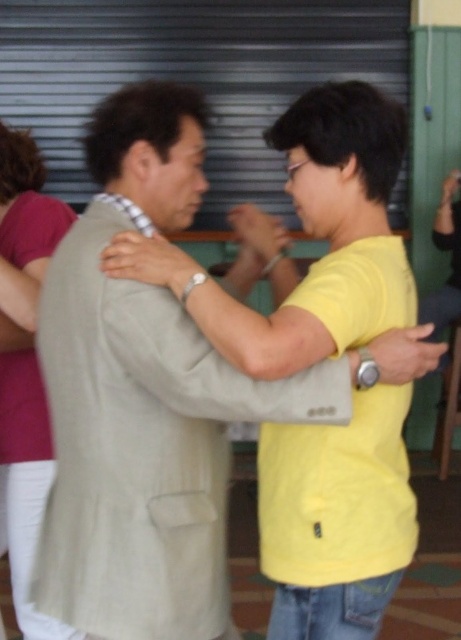
Does light beige suit at center appear on the left side of matte pink shirt at left?

No, light beige suit at center is not to the left of matte pink shirt at left.

Who is more distant from viewer, (306, 586) or (18, 396)?

The point (18, 396) is behind.

Identify the location of light beige suit at center. This screenshot has width=461, height=640. (338, 524).